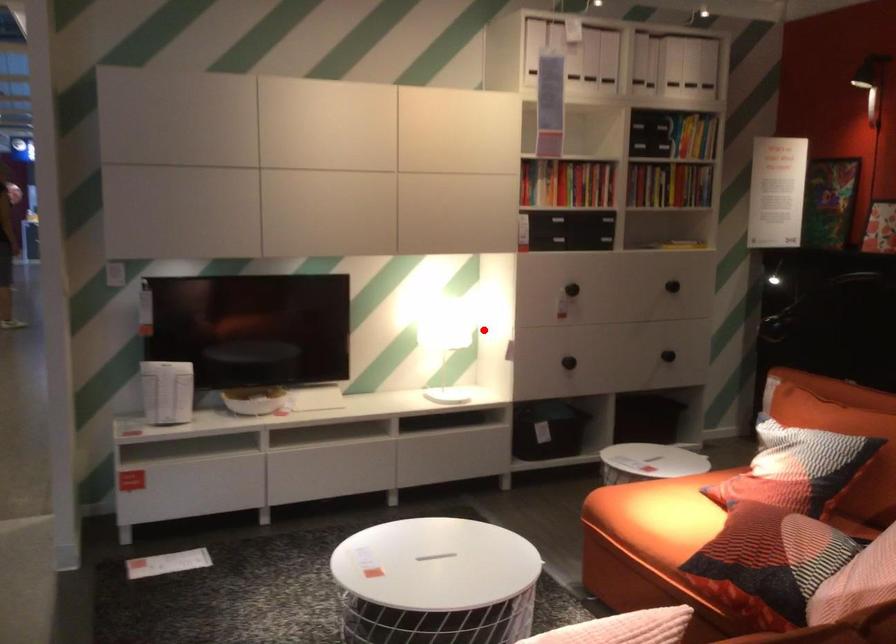
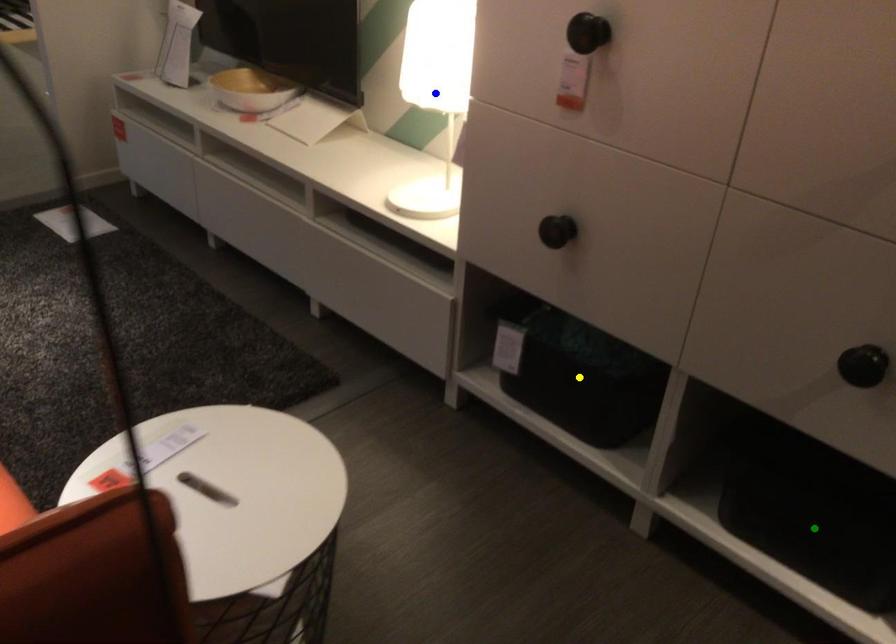
Question: I am providing you with two images of the same scene from different viewpoints. A red point is marked on the first image. You are given multiple points on the second image. Can you choose the point in image 2 that corresponds to the point in image 1?

Choices:
 (A) green point
 (B) yellow point
 (C) blue point

Answer: (C)